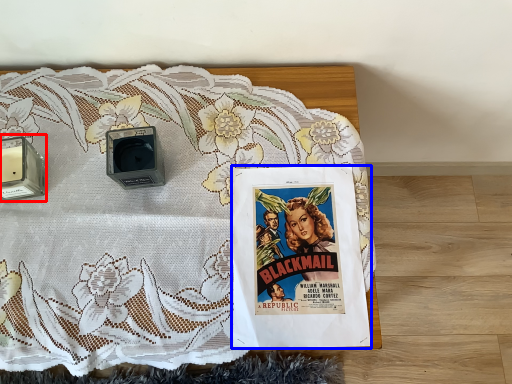
Question: Which object is further to the camera taking this photo, speaker (highlighted by a red box) or comic book (highlighted by a blue box)?

Choices:
 (A) speaker
 (B) comic book

Answer: (A)